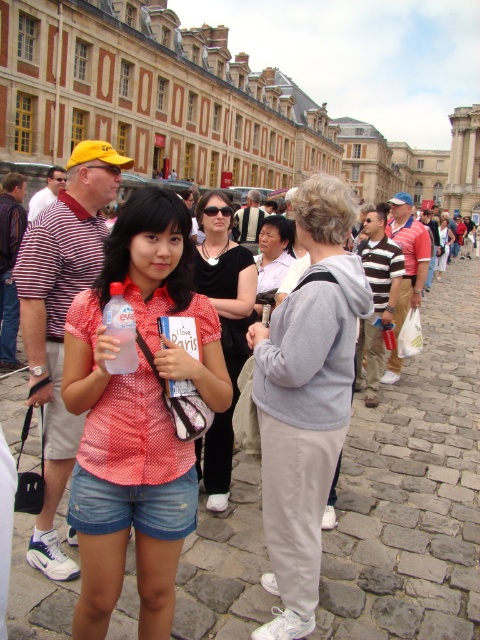
Does polka dot fabric shirt at center appear under light gray sweatshirt at center?

Yes, polka dot fabric shirt at center is below light gray sweatshirt at center.

Can you confirm if polka dot fabric shirt at center is wider than light gray sweatshirt at center?

Yes, polka dot fabric shirt at center is wider than light gray sweatshirt at center.

Which is behind, point (193, 296) or point (362, 276)?

The point (362, 276) is more distant.

You are a GUI agent. You are given a task and a screenshot of the screen. Output one action in this format:
    pyautogui.click(x=<x>, y=<y>)
    Task: Click on the polka dot fabric shirt at center
    
    Given the screenshot: What is the action you would take?
    pyautogui.click(x=136, y=417)

Can you confirm if light gray sweatshirt at center is taller than matte black shirt at center?

Yes, light gray sweatshirt at center is taller than matte black shirt at center.

Measure the distance between point (304, 513) and camera.

Point (304, 513) and camera are 32.45 meters apart from each other.

Is point (302, 612) in front of point (220, 465)?

Yes, it is in front of point (220, 465).

Where is `light gray sweatshirt at center`? This screenshot has width=480, height=640. light gray sweatshirt at center is located at coordinates (305, 400).

Looking at this image, between matte black shirt at center and transparent plastic bottle at center, which one has less height?

Standing shorter between the two is transparent plastic bottle at center.

The height and width of the screenshot is (640, 480). Find the location of `matte black shirt at center`. matte black shirt at center is located at coordinates (223, 330).

This screenshot has width=480, height=640. Find the location of `matte black shirt at center`. matte black shirt at center is located at coordinates (223, 330).

Identify the location of matte black shirt at center. (223, 330).